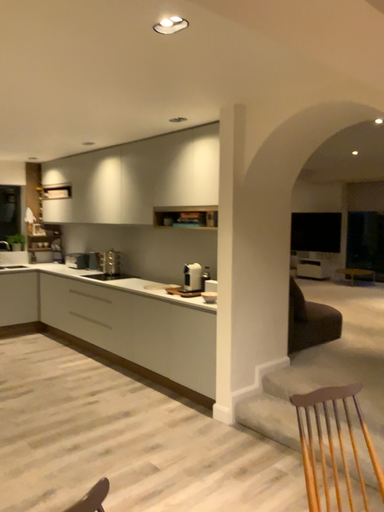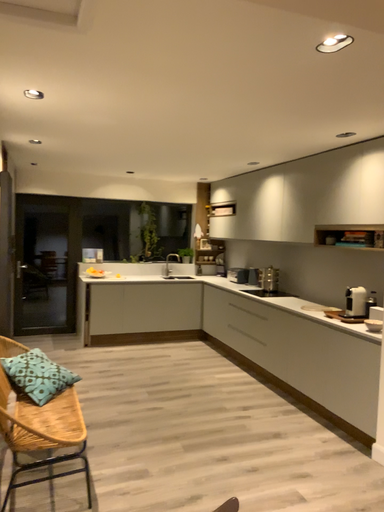
Question: Which way did the camera rotate in the video?

Choices:
 (A) rotated right
 (B) rotated left

Answer: (B)